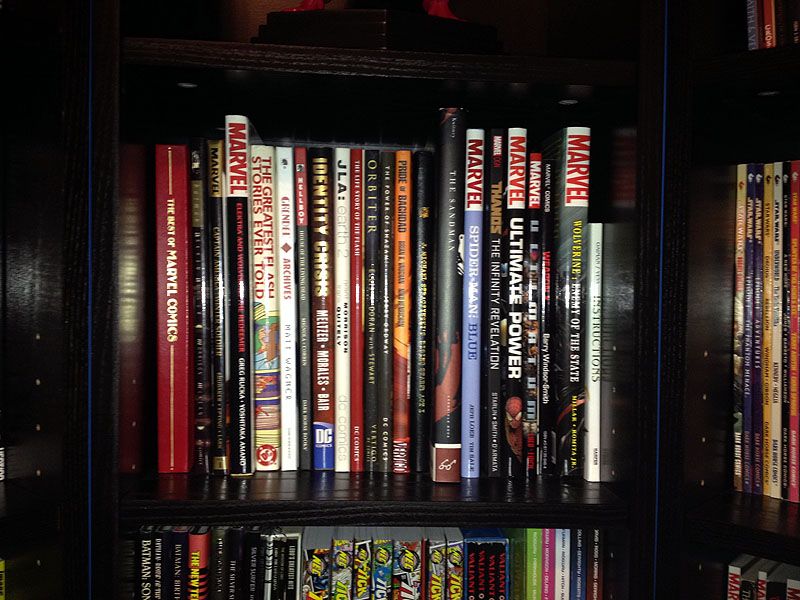
In order to click on faces of shelves in this screenshot , I will do `click(374, 509)`, `click(373, 65)`, `click(766, 549)`, `click(774, 97)`.